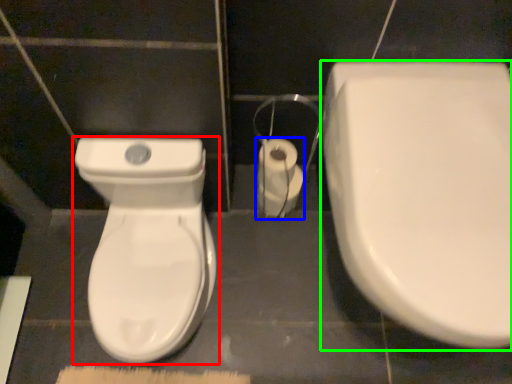
Question: Which object is positioned closest to toilet (highlighted by a red box)? Select from toilet paper (highlighted by a blue box) and toilet (highlighted by a green box).

Choices:
 (A) toilet paper
 (B) toilet

Answer: (A)